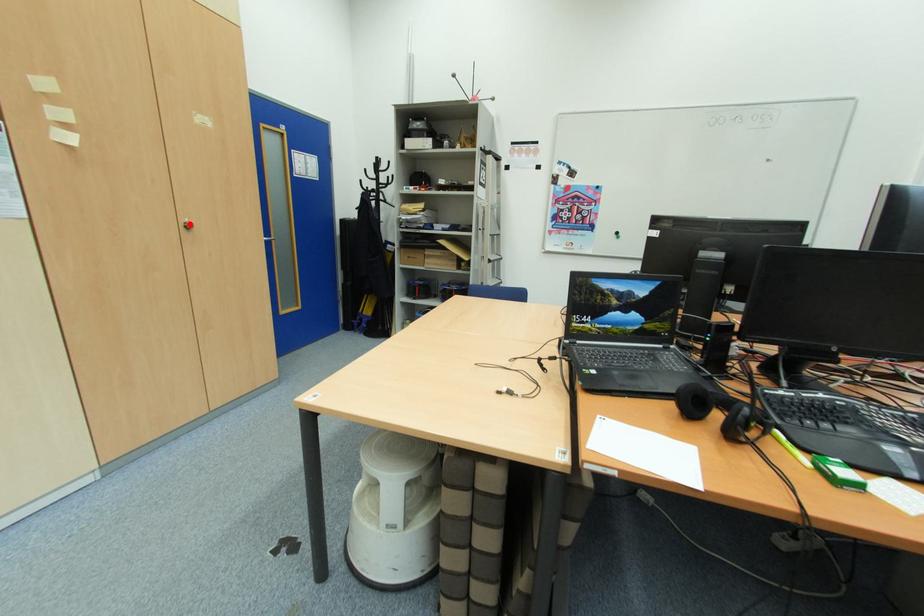
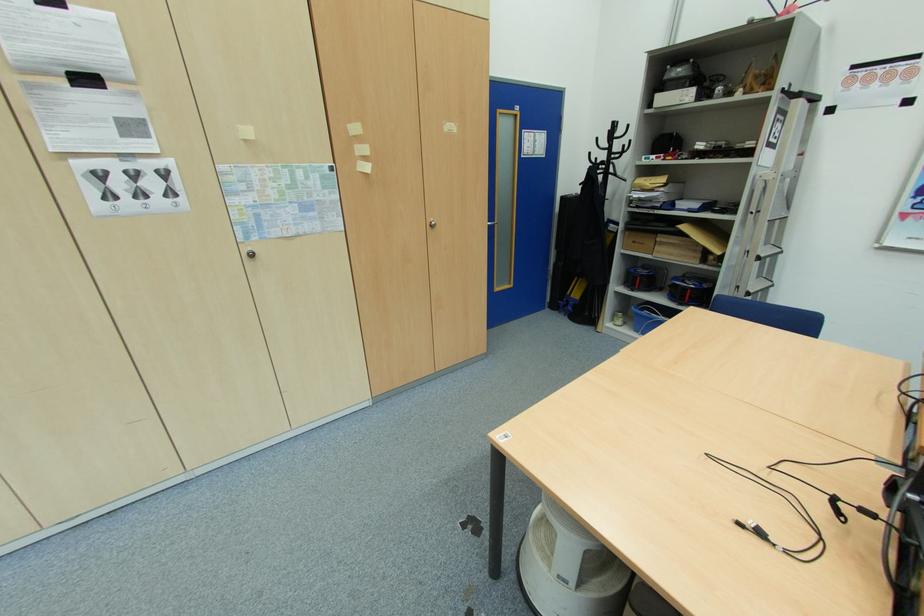
Where in the second image is the point corresponding to the highlighted location from the first image?

(434, 224)